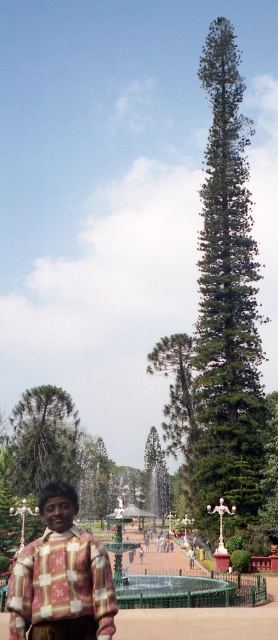
Question: Is green textured pine tree at center to the left of green matte tree at center from the viewer's perspective?

Choices:
 (A) no
 (B) yes

Answer: (A)

Question: Among these objects, which one is nearest to the camera?

Choices:
 (A) green textured pine tree at center
 (B) plaid fabric shirt at lower left
 (C) green matte tree at center

Answer: (B)

Question: Estimate the real-world distances between objects in this image. Which object is farther from the green textured pine tree at center?

Choices:
 (A) green matte tree at center
 (B) plaid fabric shirt at lower left

Answer: (B)

Question: Does green textured pine tree at center lie behind plaid fabric shirt at lower left?

Choices:
 (A) no
 (B) yes

Answer: (B)

Question: Which of these objects is positioned closest to the green textured pine tree at center?

Choices:
 (A) green matte tree at center
 (B) plaid fabric shirt at lower left

Answer: (A)

Question: Can you confirm if green textured pine tree at center is thinner than green matte tree at center?

Choices:
 (A) yes
 (B) no

Answer: (A)